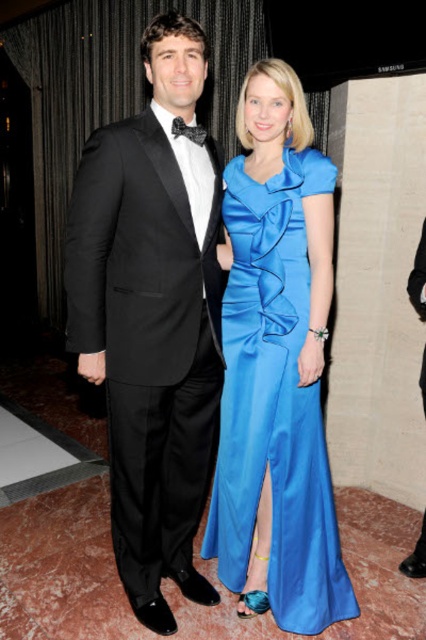
Question: Which point is farther to the camera?

Choices:
 (A) (175, 134)
 (B) (88, 172)

Answer: (A)

Question: Is satin blue dress at center below black satin bow tie at upper center?

Choices:
 (A) yes
 (B) no

Answer: (A)

Question: Where is black satin tuxedo at left located in relation to satin blue dress at center in the image?

Choices:
 (A) right
 (B) left

Answer: (B)

Question: Which point appears closest to the camera in this image?

Choices:
 (A) (271, 371)
 (B) (169, 401)
 (C) (192, 138)

Answer: (C)

Question: Is the position of black satin tuxedo at left more distant than that of satin blue dress at center?

Choices:
 (A) yes
 (B) no

Answer: (B)

Question: Which of these objects is positioned closest to the black satin tuxedo at left?

Choices:
 (A) satin blue dress at center
 (B) black satin bow tie at upper center

Answer: (A)